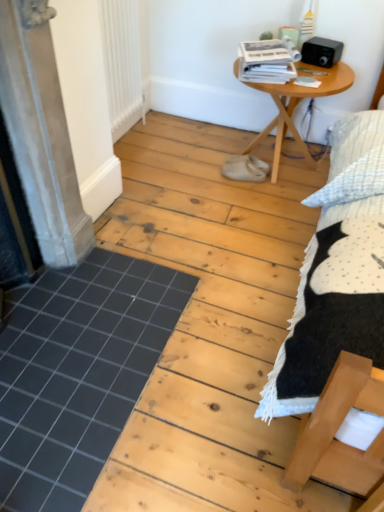
Question: Can you see black tile at lower left touching wooden table at center?

Choices:
 (A) yes
 (B) no

Answer: (B)

Question: Would you consider black tile at lower left to be distant from wooden table at center?

Choices:
 (A) no
 (B) yes

Answer: (B)

Question: Does black tile at lower left have a lesser height compared to wooden table at center?

Choices:
 (A) no
 (B) yes

Answer: (B)

Question: Does black tile at lower left have a greater width compared to wooden table at center?

Choices:
 (A) yes
 (B) no

Answer: (A)

Question: From the image's perspective, does black tile at lower left appear higher than wooden table at center?

Choices:
 (A) yes
 (B) no

Answer: (B)

Question: Considering the relative sizes of black tile at lower left and wooden table at center in the image provided, is black tile at lower left bigger than wooden table at center?

Choices:
 (A) yes
 (B) no

Answer: (B)

Question: Are white matte radiator at upper left and black tile at lower left far apart?

Choices:
 (A) no
 (B) yes

Answer: (B)

Question: From a real-world perspective, is white matte radiator at upper left positioned under black tile at lower left based on gravity?

Choices:
 (A) no
 (B) yes

Answer: (A)

Question: Would you say white matte radiator at upper left contains black tile at lower left?

Choices:
 (A) no
 (B) yes

Answer: (A)

Question: Is white matte radiator at upper left oriented away from black tile at lower left?

Choices:
 (A) yes
 (B) no

Answer: (B)

Question: Can you confirm if white matte radiator at upper left is wider than black tile at lower left?

Choices:
 (A) yes
 (B) no

Answer: (B)

Question: From the image's perspective, is white matte radiator at upper left over black tile at lower left?

Choices:
 (A) yes
 (B) no

Answer: (A)

Question: Is black tile at lower left shorter than matte gray screen door at left?

Choices:
 (A) no
 (B) yes

Answer: (B)